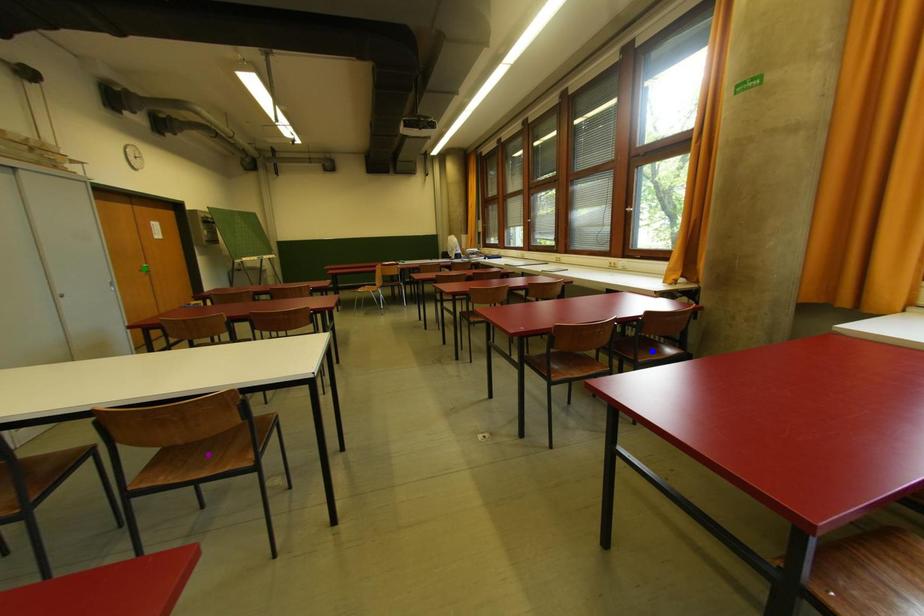
Order these from farthest to nearest:
- purple point
- green point
- blue point

1. green point
2. blue point
3. purple point